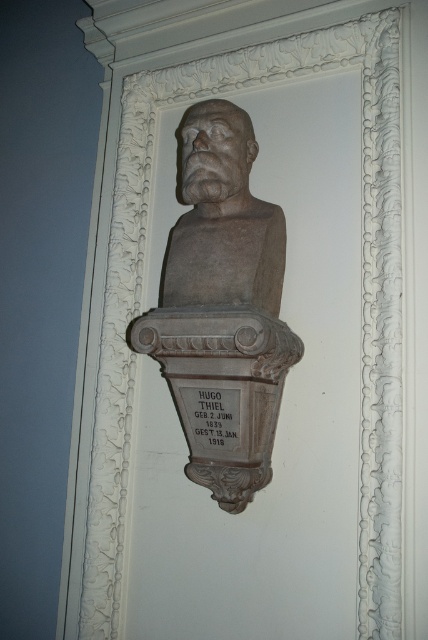
You are an art conservator assessing the placement of the gray stone bust at center within its ornate frame. Based on the coordinates provided in the description, is the bust positioned exactly at the center of the frame or slightly offset? Please explain your reasoning.

The gray stone bust at center is located at coordinates approximately 0.484 on the x and 0.521 on the y. Since these values are very close to 0.5, which would be the exact center, the bust is positioned nearly centrally within the frame, with only a slight offset to the left and downward from the true center point.

Which object is bigger between the gray stone bust at center and the matte stone bust at center?

The gray stone bust at center is larger in size than the matte stone bust at center.